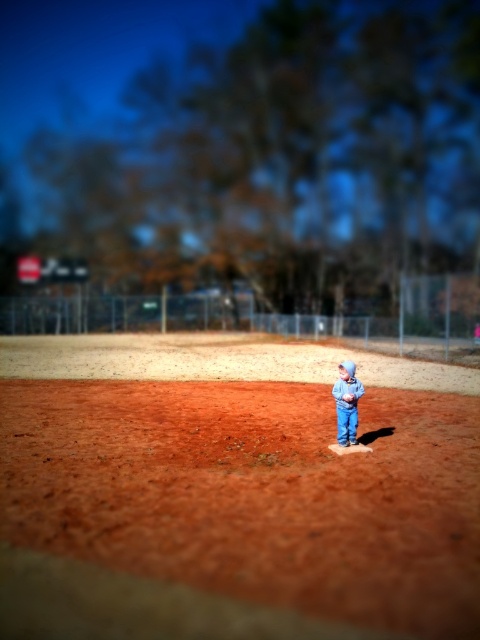
You are a photographer trying to capture the child in the scene. If you focus on the brown dirt field at center, will the blue denim pants at center be in focus as well?

The brown dirt field at center is closer to the viewer than blue denim pants at center. Since the focus is on the brown dirt field, the blue denim pants at center will be out of focus.

You are a photographer trying to capture the child in the image. To ensure the blue denim pants at center and the brown dirt field at center are both in focus, which object should you focus on first? Explain your reasoning based on their positions.

The brown dirt field at center is located below the blue denim pants at center. Since the pants are above the dirt field, you should focus on the blue denim pants at center first as it is closer to the camera, ensuring both will be in focus when using a shallow depth of field.

You are a photographer trying to capture the child in the scene. If you want to focus on the blue denim pants at center without including the brown dirt field at center, where should you position your camera relative to the child?

The brown dirt field at center is positioned on the left side of blue denim pants at center. To avoid capturing the brown dirt field at center, you should position your camera to the right side of the child so that the dirt field is out of frame.